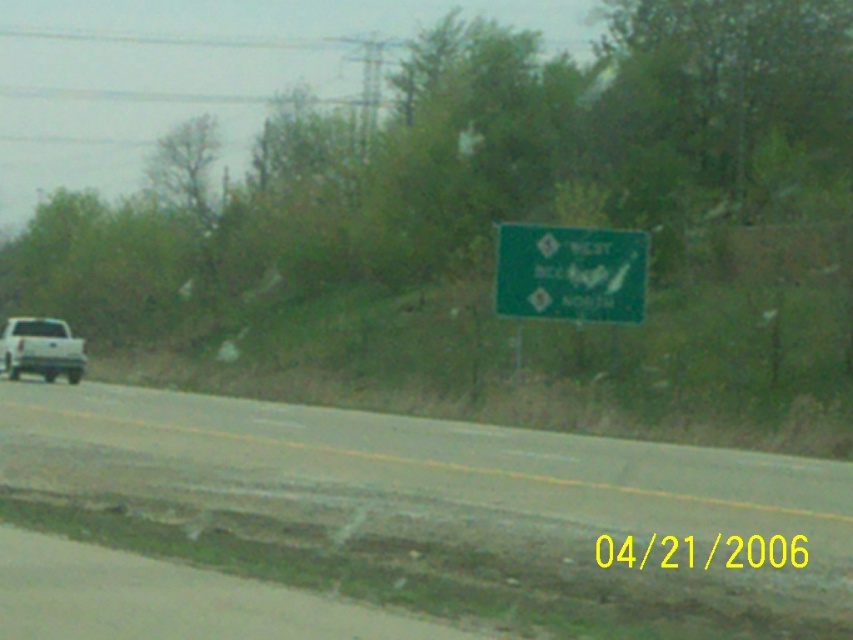
Question: Does green matte sign at upper center appear over white matte truck at left?

Choices:
 (A) yes
 (B) no

Answer: (A)

Question: Which object is positioned farthest from the white matte truck at left?

Choices:
 (A) gray asphalt road at center
 (B) green matte sign at upper center

Answer: (A)

Question: Does gray asphalt road at center lie in front of white matte truck at left?

Choices:
 (A) yes
 (B) no

Answer: (A)

Question: Which point is farther to the camera?

Choices:
 (A) white matte truck at left
 (B) green matte sign at upper center

Answer: (A)

Question: Does gray asphalt road at center appear on the right side of green matte sign at upper center?

Choices:
 (A) no
 (B) yes

Answer: (A)

Question: Which object is closer to the camera taking this photo?

Choices:
 (A) gray asphalt road at center
 (B) green matte sign at upper center
 (C) white matte truck at left

Answer: (A)